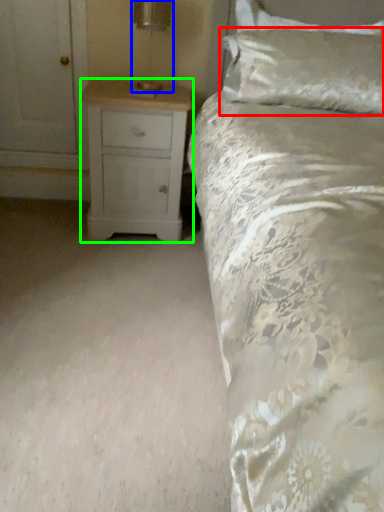
Question: Which is nearer to the pillow (highlighted by a red box)? table lamp (highlighted by a blue box) or chest of drawers (highlighted by a green box).

Choices:
 (A) table lamp
 (B) chest of drawers

Answer: (B)